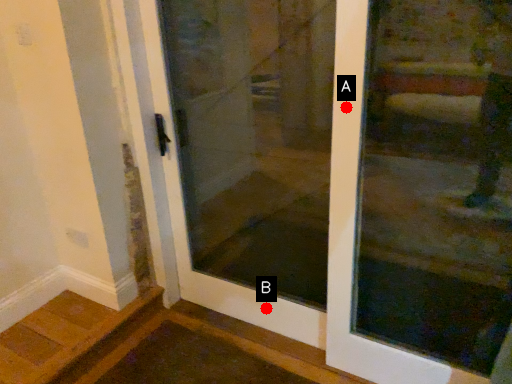
Question: Two points are circled on the image, labeled by A and B beside each circle. Among these points, which one is nearest to the camera?

Choices:
 (A) A is closer
 (B) B is closer

Answer: (A)